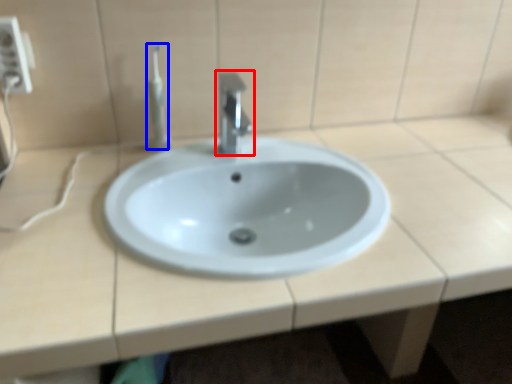
Question: Which object appears farthest to the camera in this image, tap (highlighted by a red box) or toothbrush (highlighted by a blue box)?

Choices:
 (A) tap
 (B) toothbrush

Answer: (B)